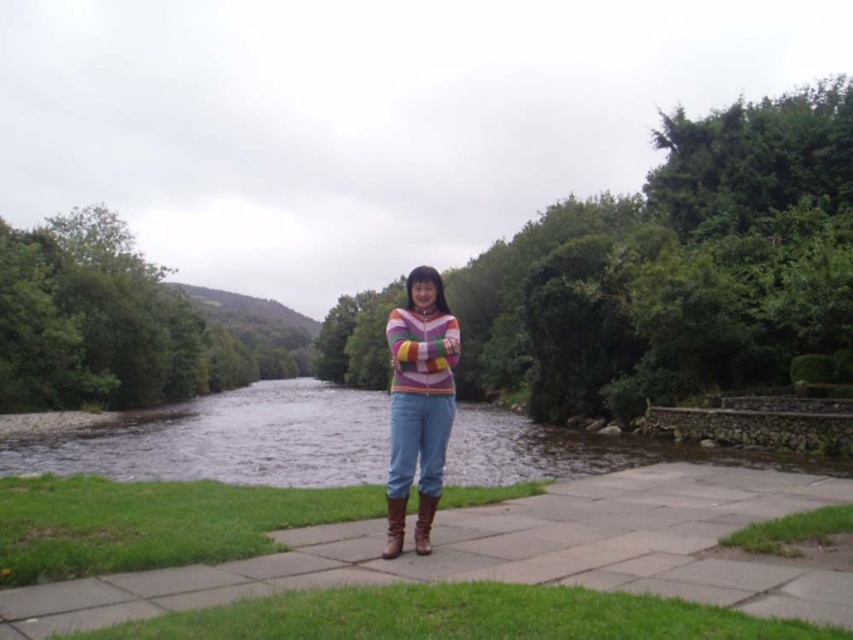
Is green grass at lower left to the left of striped sweater at center from the viewer's perspective?

Correct, you'll find green grass at lower left to the left of striped sweater at center.

Between green grass at lower left and striped sweater at center, which one has more height?

With more height is striped sweater at center.

Find the location of `green grass at lower left`. green grass at lower left is located at coordinates (152, 522).

You are a GUI agent. You are given a task and a screenshot of the screen. Output one action in this format:
    pyautogui.click(x=<x>, y=<y>)
    Task: Click on the green grass at lower left
    This screenshot has height=640, width=853.
    Given the screenshot: What is the action you would take?
    pyautogui.click(x=152, y=522)

Between point (311, 500) and point (462, 630), which one is positioned in front?

Point (462, 630)

Is green grass at lower left further to camera compared to green grass at lower center?

Yes, it is behind green grass at lower center.

Is point (247, 508) in front of point (721, 632)?

No, (247, 508) is behind (721, 632).

At what (x,y) coordinates should I click in order to perform the action: click on green grass at lower left. Please return your answer as a coordinate pair (x, y). Image resolution: width=853 pixels, height=640 pixels. Looking at the image, I should click on (152, 522).

Based on the photo, is green soft grass at lower right taller than brown leather boot at center?

In fact, green soft grass at lower right may be shorter than brown leather boot at center.

Is point (837, 518) closer to camera compared to point (393, 548)?

No, it is not.

Identify the location of green soft grass at lower right. This screenshot has width=853, height=640. tap(792, 531).